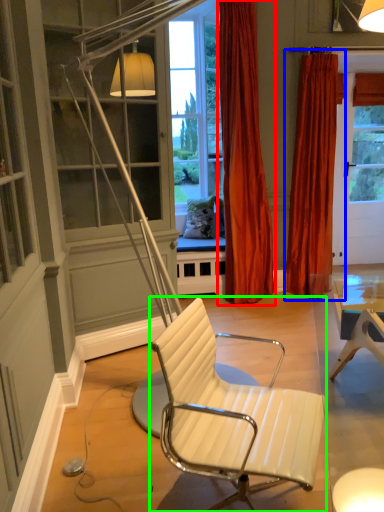
Question: Based on their relative distances, which object is farther from curtain (highlighted by a red box)? Choose from curtain (highlighted by a blue box) and chair (highlighted by a green box).

Choices:
 (A) curtain
 (B) chair

Answer: (B)